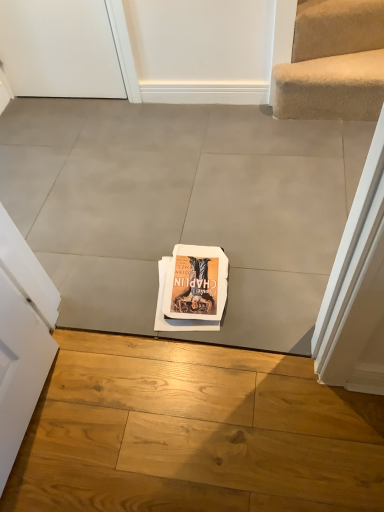
You are a GUI agent. You are given a task and a screenshot of the screen. Output one action in this format:
    pyautogui.click(x=<x>, y=<y>)
    Task: Click on the unoccupied region to the right of matte paper book at center
    The image size is (384, 512).
    Given the screenshot: What is the action you would take?
    pyautogui.click(x=275, y=301)